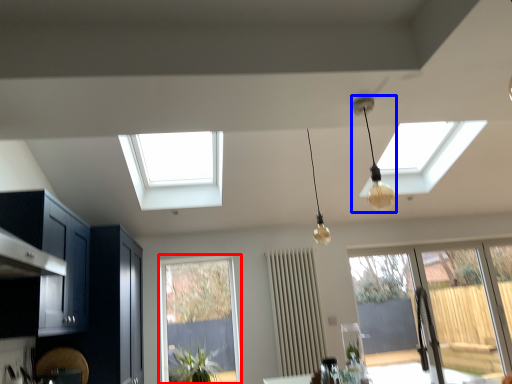
Question: Which object is closer to the camera taking this photo, window (highlighted by a red box) or lamp (highlighted by a blue box)?

Choices:
 (A) window
 (B) lamp

Answer: (B)